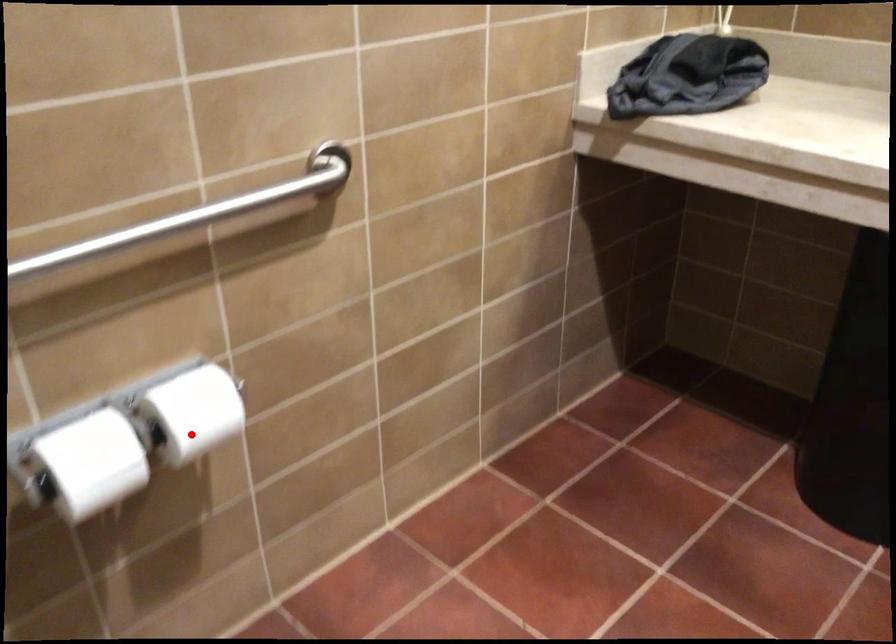
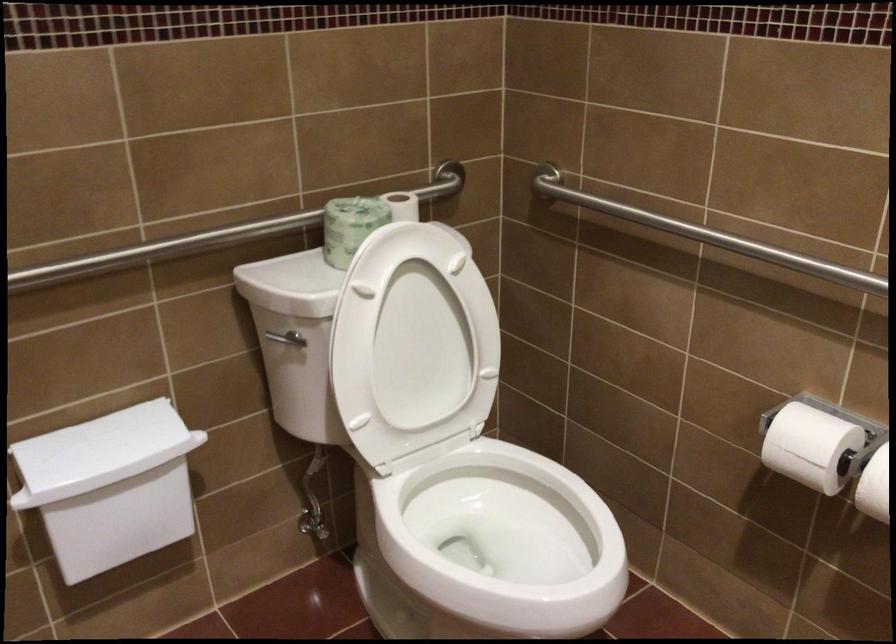
Locate, in the second image, the point that corresponds to the highlighted location in the first image.

(874, 486)